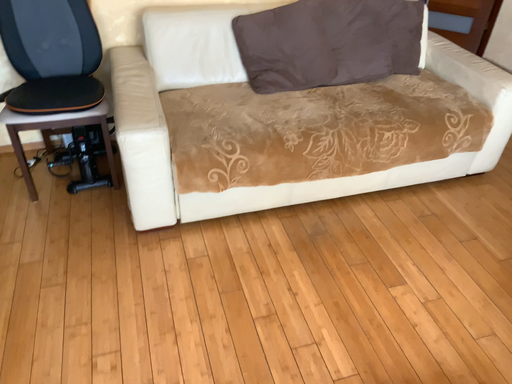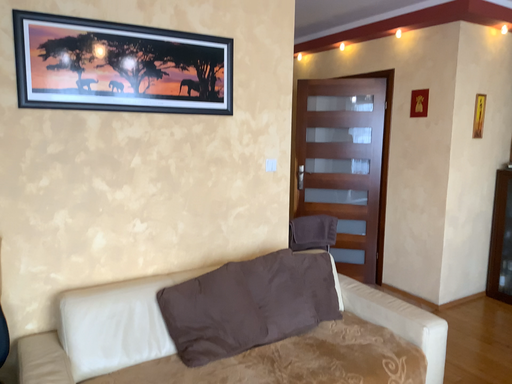
Question: How did the camera likely rotate when shooting the video?

Choices:
 (A) rotated left
 (B) rotated right

Answer: (B)